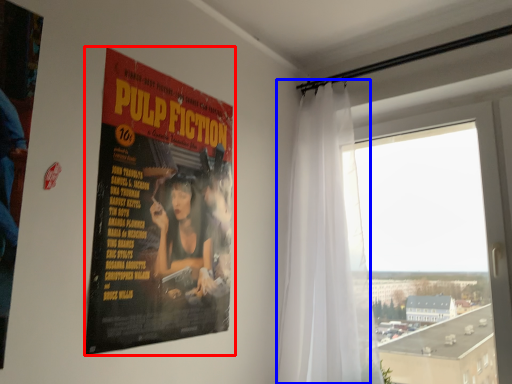
Question: Which of the following is the farthest to the observer, poster (highlighted by a red box) or curtain (highlighted by a blue box)?

Choices:
 (A) poster
 (B) curtain

Answer: (B)